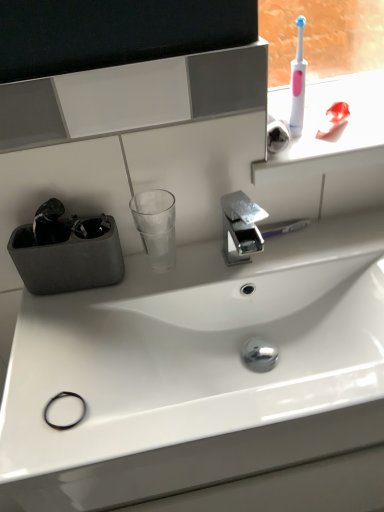
Identify the location of free space in front of transparent glass at center. (124, 309).